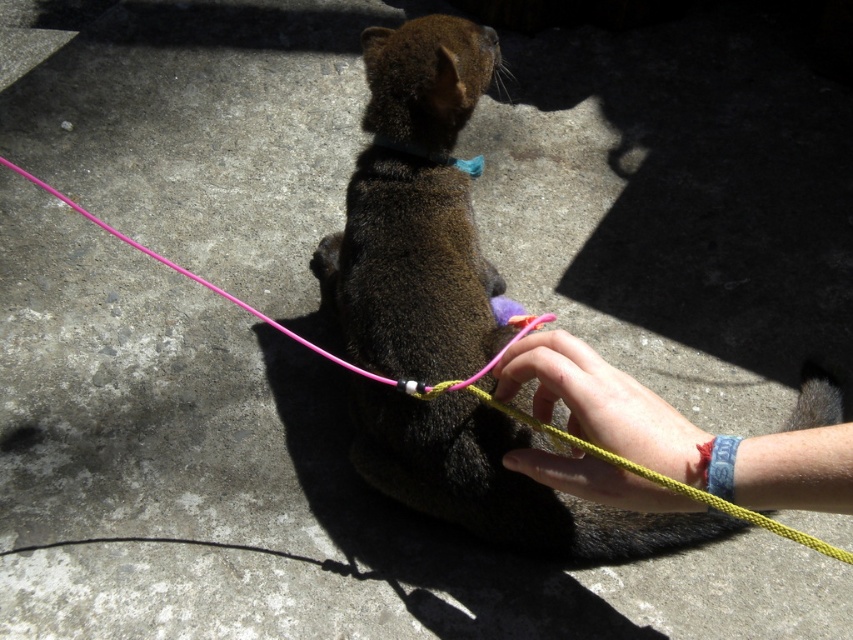
You are a veterinarian examining an animal with a pink nylon leash at center and a blue fabric neckband at center. Which of these items would you recommend replacing if you want to ensure a more secure fit for the animal?

The pink nylon leash at center has a larger size compared to the blue fabric neckband at center. Therefore, the pink nylon leash at center may need replacement to ensure a secure fit since it is larger and might not hold the animal properly.

You are a dog trainer assessing the safety of the setup for the animal. The recommended minimum distance between the yellow rope and the blue collar is 60 centimeters to prevent tangling. Based on the scene, is the current distance between the smooth yellow rope at center and the blue fabric neckband at center sufficient?

The smooth yellow rope at center is 61.81 centimeters from the blue fabric neckband at center, which exceeds the recommended minimum distance of 60 centimeters. Therefore, the current distance is sufficient to prevent tangling.